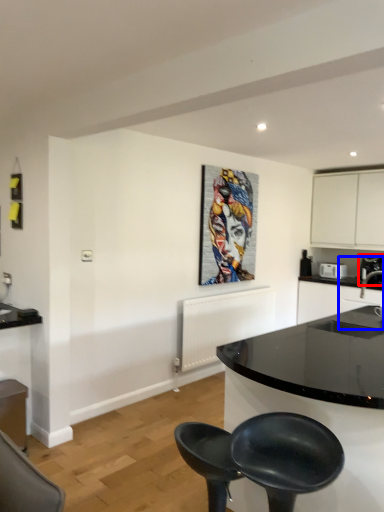
Question: Which of the following is the closest to the observer, coffee machine (highlighted by a red box) or sink (highlighted by a blue box)?

Choices:
 (A) coffee machine
 (B) sink

Answer: (B)